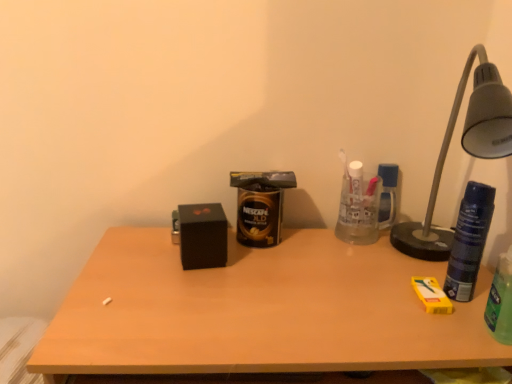
I want to click on vacant space situated on the left part of metallic gray lamp at right, so click(x=331, y=279).